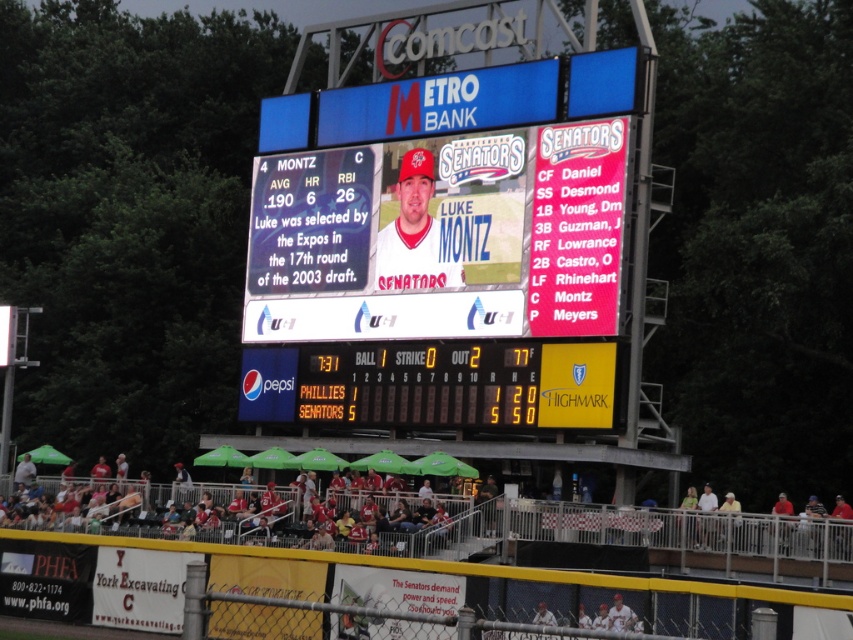
Question: Is matte plastic scoreboard at center wider than red fabric seats at lower center?

Choices:
 (A) yes
 (B) no

Answer: (B)

Question: Considering the relative positions of matte plastic scoreboard at center and red fabric seats at lower center in the image provided, where is matte plastic scoreboard at center located with respect to red fabric seats at lower center?

Choices:
 (A) above
 (B) below

Answer: (A)

Question: Which point is farther to the camera?

Choices:
 (A) (57, 461)
 (B) (444, 218)

Answer: (A)

Question: Is matte plastic scoreboard at center positioned behind red fabric seats at lower center?

Choices:
 (A) yes
 (B) no

Answer: (A)